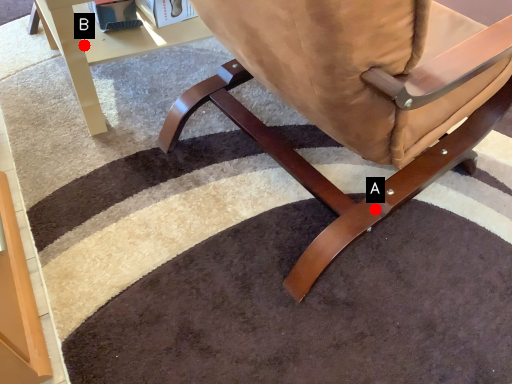
Question: Two points are circled on the image, labeled by A and B beside each circle. Among these points, which one is nearest to the camera?

Choices:
 (A) A is closer
 (B) B is closer

Answer: (A)